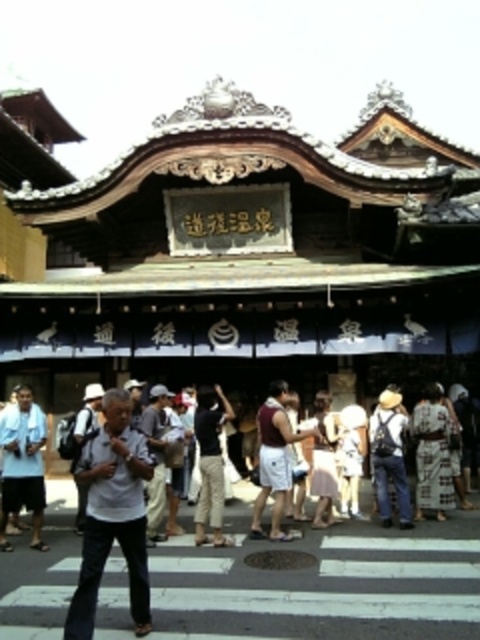
Does dark gray cotton pants at center appear on the left side of denim jeans at center?

Yes, dark gray cotton pants at center is to the left of denim jeans at center.

I want to click on dark gray cotton pants at center, so click(211, 464).

Who is more forward, (197,509) or (377,486)?

Point (197,509) is more forward.

You are a GUI agent. You are given a task and a screenshot of the screen. Output one action in this format:
    pyautogui.click(x=<x>, y=<y>)
    Task: Click on the dark gray cotton pants at center
    The image size is (480, 640).
    Given the screenshot: What is the action you would take?
    pyautogui.click(x=211, y=464)

Can you confirm if white towel at left is wider than maroon fabric shirt at center?

Incorrect, white towel at left's width does not surpass maroon fabric shirt at center's.

Which is more to the left, white towel at left or maroon fabric shirt at center?

white towel at left

Between point (10, 500) and point (300, 433), which one is positioned in front?

Point (10, 500) is in front.

The width and height of the screenshot is (480, 640). In order to click on white towel at left in this screenshot , I will do `click(23, 465)`.

Which of these two, pink fabric dress at center or white matte backpack at center, stands taller?

Standing taller between the two is white matte backpack at center.

Is point (328, 509) closer to viewer compared to point (98, 394)?

Yes, point (328, 509) is in front of point (98, 394).

Locate an element on the screen. This screenshot has width=480, height=640. pink fabric dress at center is located at coordinates click(324, 461).